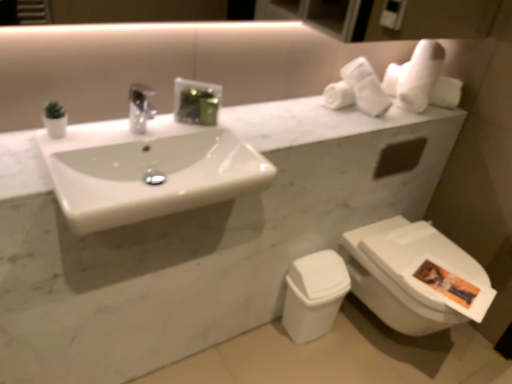
Where is `free point to the right of white plastic toilet bowl at lower right`? free point to the right of white plastic toilet bowl at lower right is located at coordinates tap(353, 339).